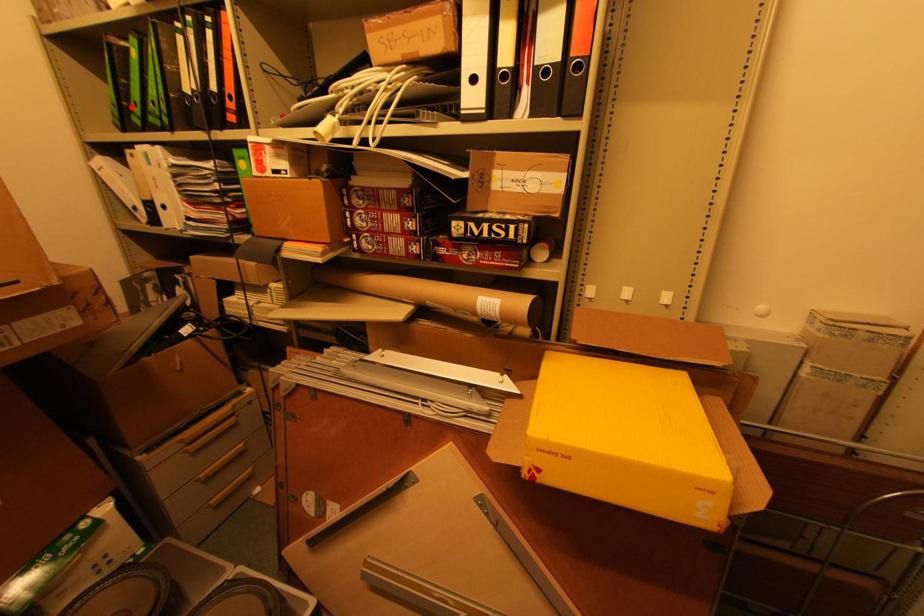
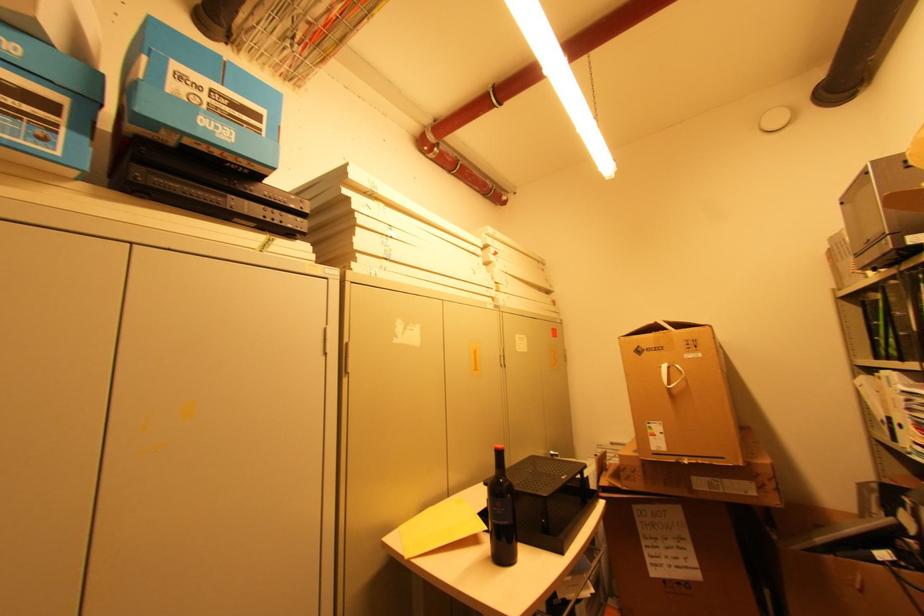
Question: I am providing you with two images of the same scene from different viewpoints. Given a red point in image1, look at the same physical point in image2. Is it:

Choices:
 (A) Closer to the viewpoint
 (B) Farther from the viewpoint

Answer: (A)